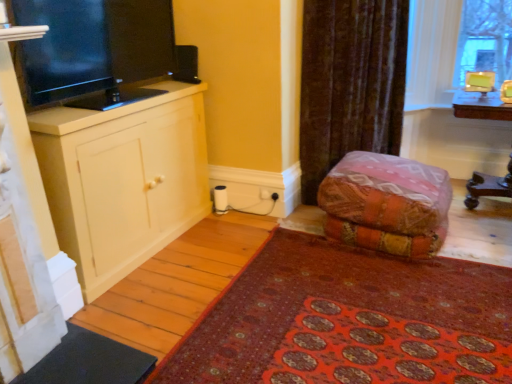
Question: Is point (68, 211) positioned closer to the camera than point (69, 18)?

Choices:
 (A) farther
 (B) closer

Answer: (A)

Question: Is matte white cabinet at left taller or shorter than black glossy tv at left?

Choices:
 (A) short
 (B) tall

Answer: (B)

Question: Estimate the real-world distances between objects in this image. Which object is farther from the wooden table at right?

Choices:
 (A) textured orange fabric at center
 (B) red carpet at lower right
 (C) black glossy tv at left
 (D) velvet brown curtain at upper right
 (E) matte white cabinet at left

Answer: (C)

Question: Estimate the real-world distances between objects in this image. Which object is farther from the red carpet at lower right?

Choices:
 (A) velvet brown curtain at upper right
 (B) textured orange fabric at center
 (C) matte white cabinet at left
 (D) black glossy tv at left
 (E) wooden table at right

Answer: (E)